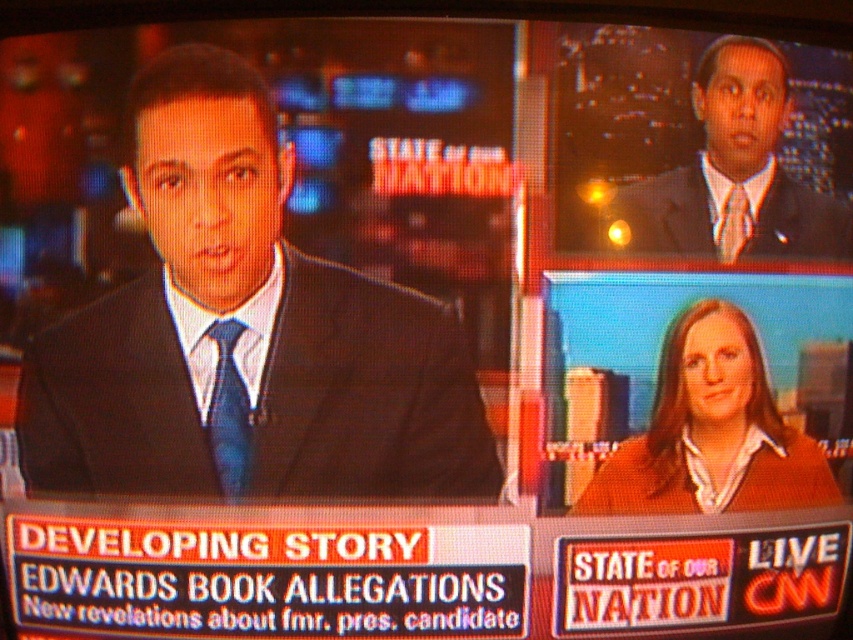
This screenshot has height=640, width=853. What do you see at coordinates (711, 432) in the screenshot?
I see `brown sweater at lower right` at bounding box center [711, 432].

Which is more to the left, brown sweater at lower right or matte black suit at upper right?

Positioned to the left is matte black suit at upper right.

Which is behind, point (695, 477) or point (692, 180)?

The point (695, 477) is behind.

The width and height of the screenshot is (853, 640). What are the coordinates of `brown sweater at lower right` in the screenshot? It's located at (711, 432).

Which is behind, point (346, 401) or point (236, 451)?

The point (236, 451) is more distant.

Where is `matte black suit at left`? The height and width of the screenshot is (640, 853). matte black suit at left is located at coordinates coord(245,330).

Is point (196, 131) closer to camera compared to point (248, 417)?

Yes, point (196, 131) is in front of point (248, 417).

The image size is (853, 640). I want to click on matte black suit at left, so click(245, 330).

Between point (728, 92) and point (717, 244), which one is positioned in front?

Point (728, 92)

Is dark suit at upper right above matte black suit at upper right?

Indeed, dark suit at upper right is positioned over matte black suit at upper right.

Locate an element on the screen. dark suit at upper right is located at coordinates (733, 173).